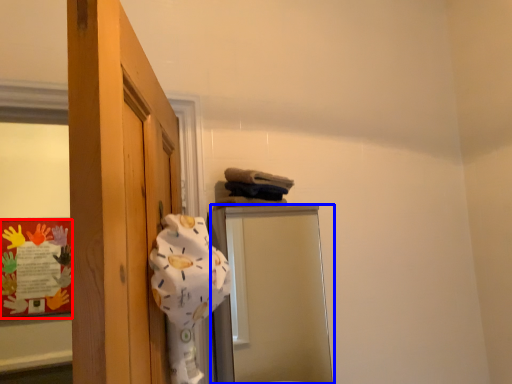
Question: Among these objects, which one is farthest to the camera, bulletin board (highlighted by a red box) or mirror (highlighted by a blue box)?

Choices:
 (A) bulletin board
 (B) mirror

Answer: (A)